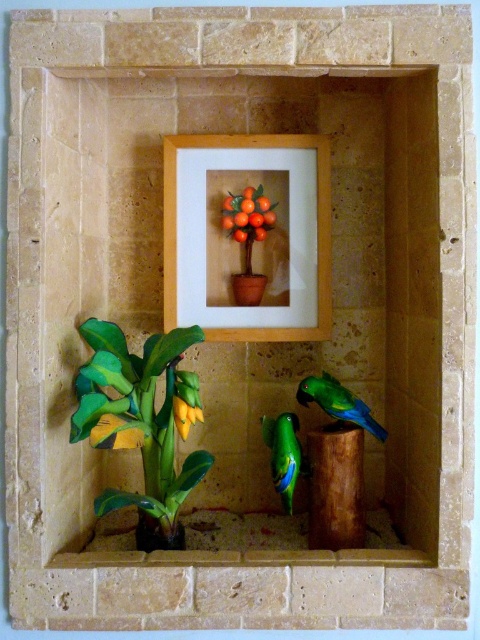
Question: Is yellow-green plastic plant at lower left to the left of wooden frame at center from the viewer's perspective?

Choices:
 (A) no
 (B) yes

Answer: (B)

Question: Estimate the real-world distances between objects in this image. Which object is farther from the wooden frame at center?

Choices:
 (A) green glossy parrot at center
 (B) green matte parrot at lower right
 (C) matte green vase at lower left
 (D) orange matte/orange-painted flower at upper center

Answer: (C)

Question: Which object appears farthest from the camera in this image?

Choices:
 (A) yellow matte flower at lower center
 (B) green matte parrot at lower right

Answer: (B)

Question: Is green glossy parrot at center closer to camera compared to yellow matte flower at lower center?

Choices:
 (A) yes
 (B) no

Answer: (B)

Question: Which of the following is the farthest from the observer?

Choices:
 (A) yellow matte flower at lower center
 (B) green glossy parrot at center
 (C) green matte parrot at lower right

Answer: (C)

Question: Is matte green vase at lower left positioned at the back of matte orange vase at center?

Choices:
 (A) yes
 (B) no

Answer: (B)